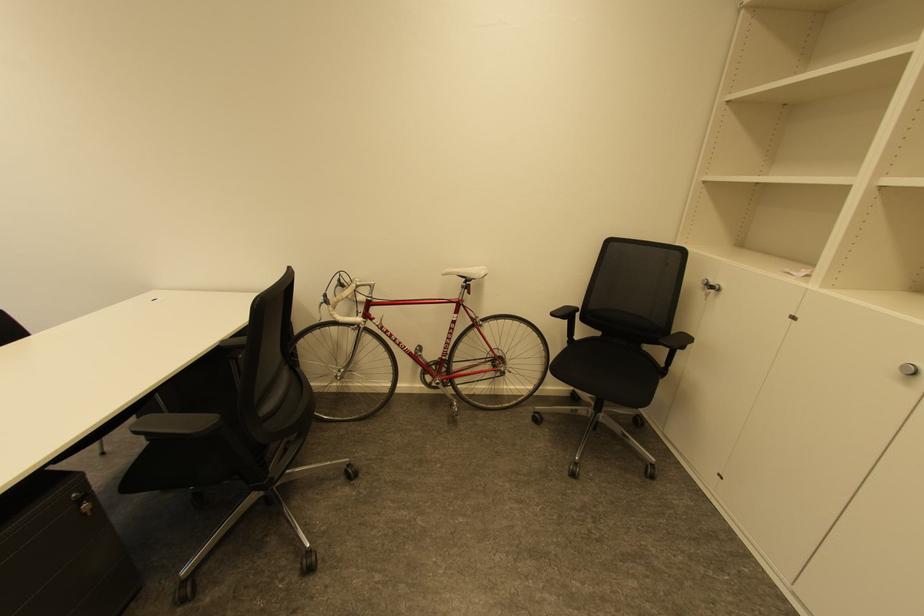
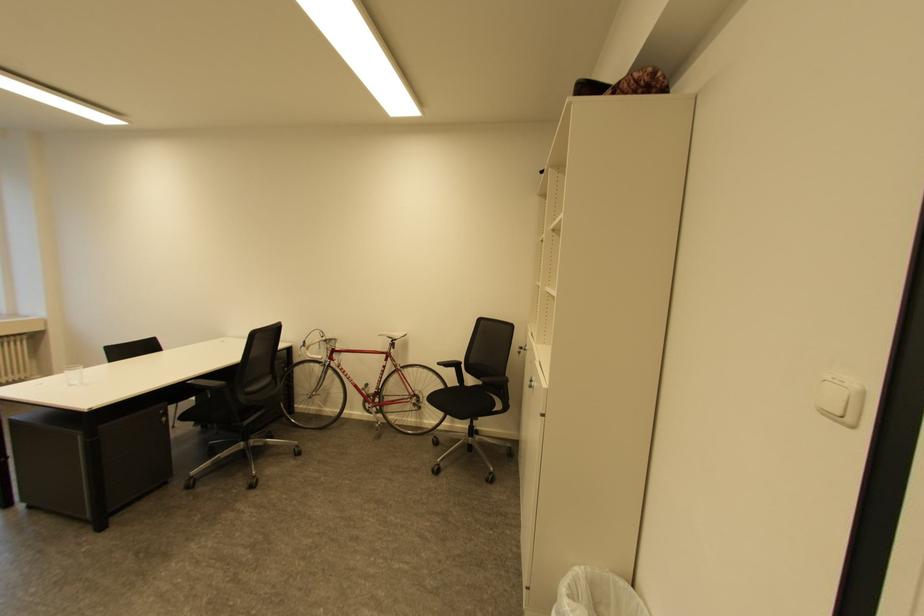
The images are taken continuously from a first-person perspective. In which direction are you moving?

The cameraman moved toward right, backward.